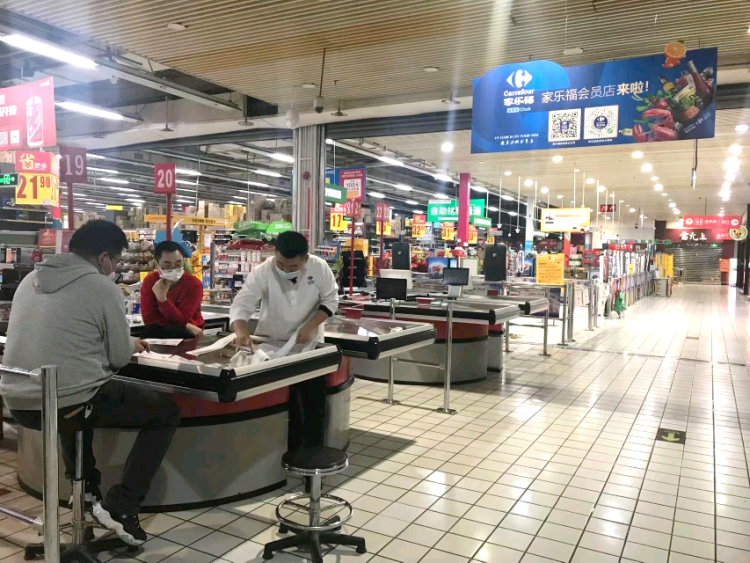
At what (x,y) coordinates should I click in order to perform the action: click on stool. Please return your answer as a coordinate pair (x, y). This screenshot has height=563, width=750. Looking at the image, I should click on (316, 463).